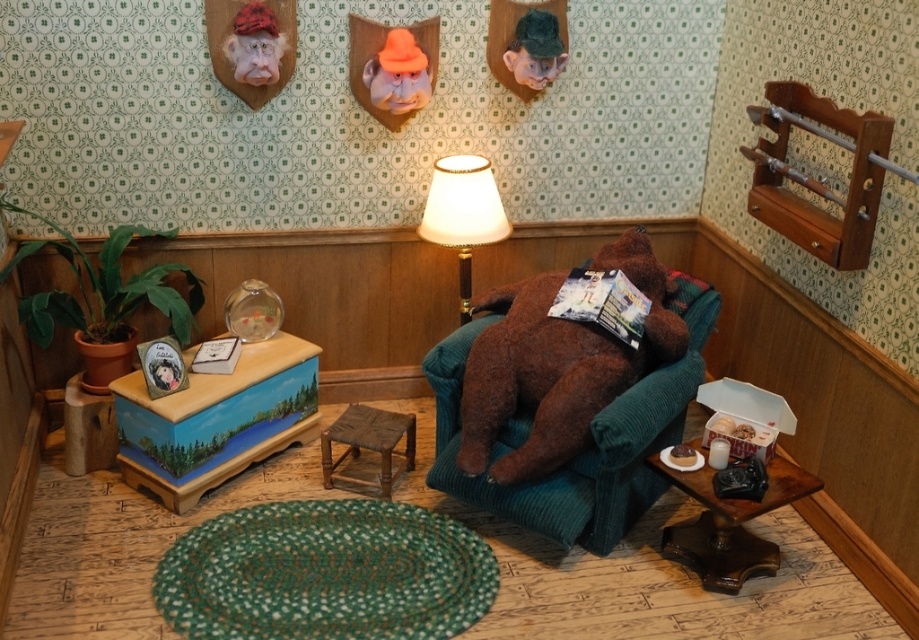
You are a tiny visitor in this miniature living room and want to place a small decoration between the white fabric lampshade at center and the rustic wood stool at center. Which object should you place it closer to if you want it to be on the left side of the lampshade?

You should place the decoration closer to the rustic wood stool at center because the white fabric lampshade at center is to the right of the rustic wood stool at center, so the stool is on the left side relative to the lampshade.

You are a tiny visitor in this miniature living room. You need to place a small vase on the wooden side table painted with a scenic landscape, which is to the left of the brown plush bear at center. Can you confirm the position of the wooden side table relative to the bear?

The wooden side table painted with a scenic landscape is located to the left of the brown plush bear at center.